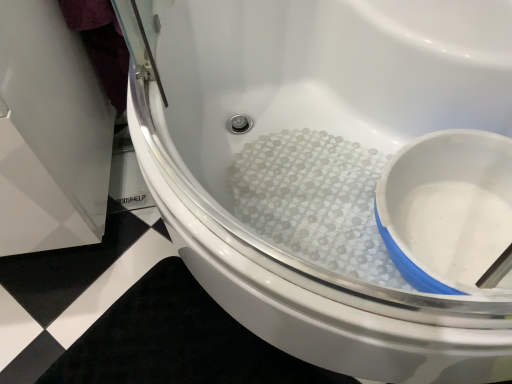
The height and width of the screenshot is (384, 512). What do you see at coordinates (314, 201) in the screenshot? I see `white matte powder at bottom right` at bounding box center [314, 201].

I want to click on white matte powder at bottom right, so click(314, 201).

Locate an element on the screen. white matte powder at bottom right is located at coordinates (314, 201).